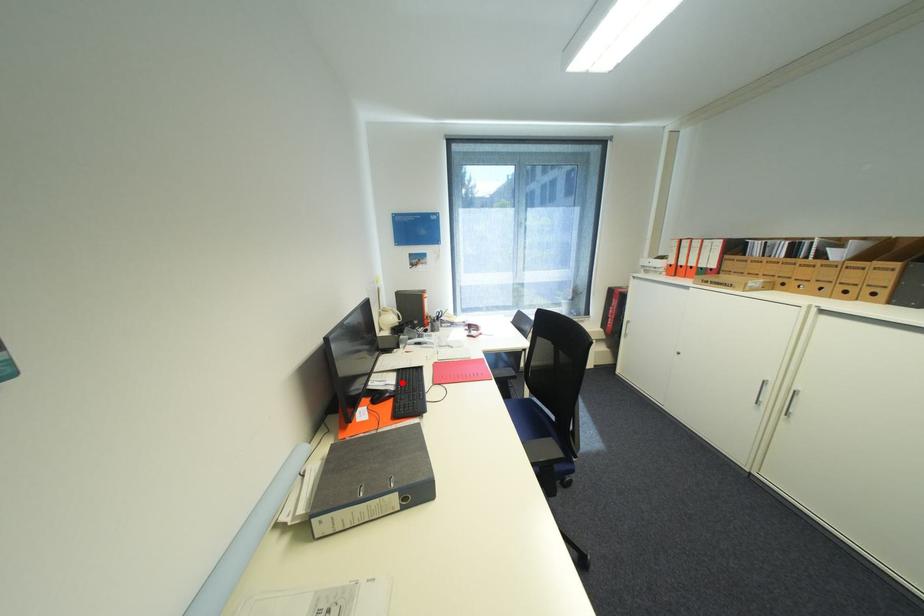
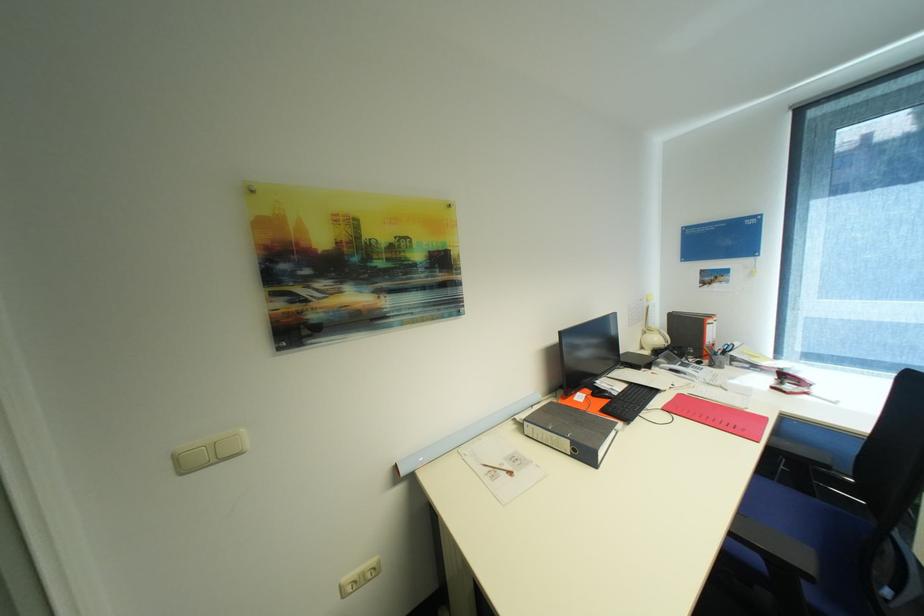
In the second image, find the point that corresponds to the highlighted location in the first image.

(627, 391)